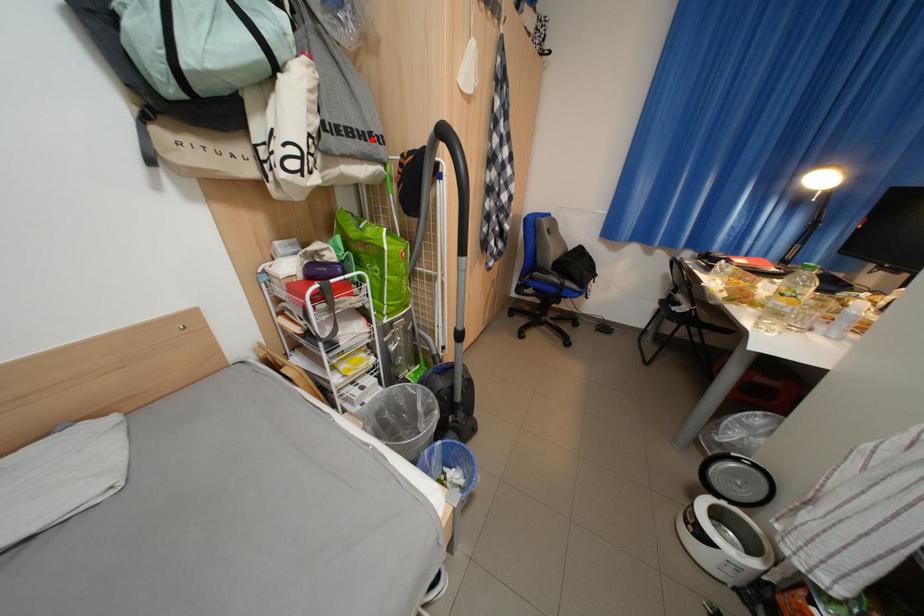
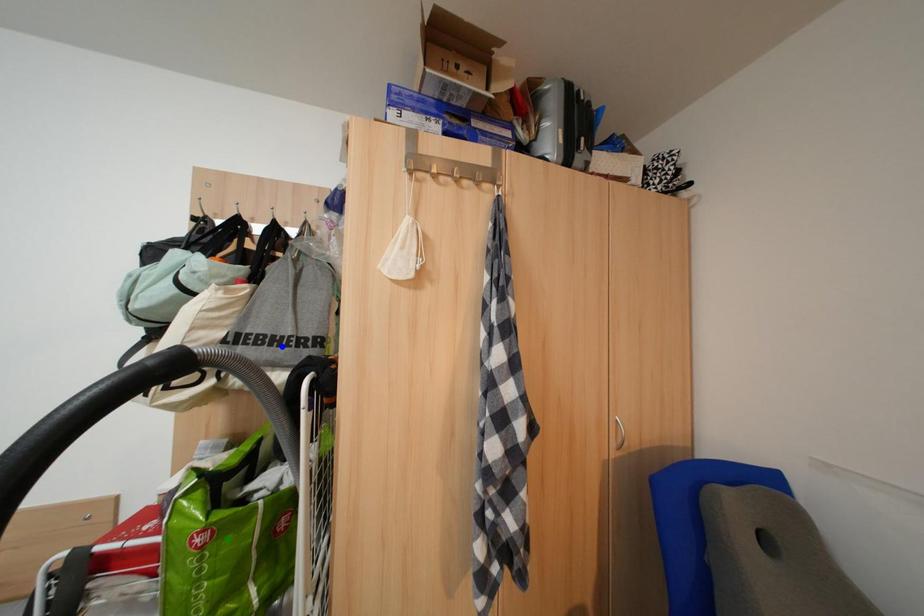
Question: I am providing you with two images of the same scene from different viewpoints. A red point is marked on the first image. You are given multiple points on the second image. Can you choose the point in image 2 that corresponds to the point in image 1?

Choices:
 (A) yellow point
 (B) blue point
 (C) green point

Answer: (B)